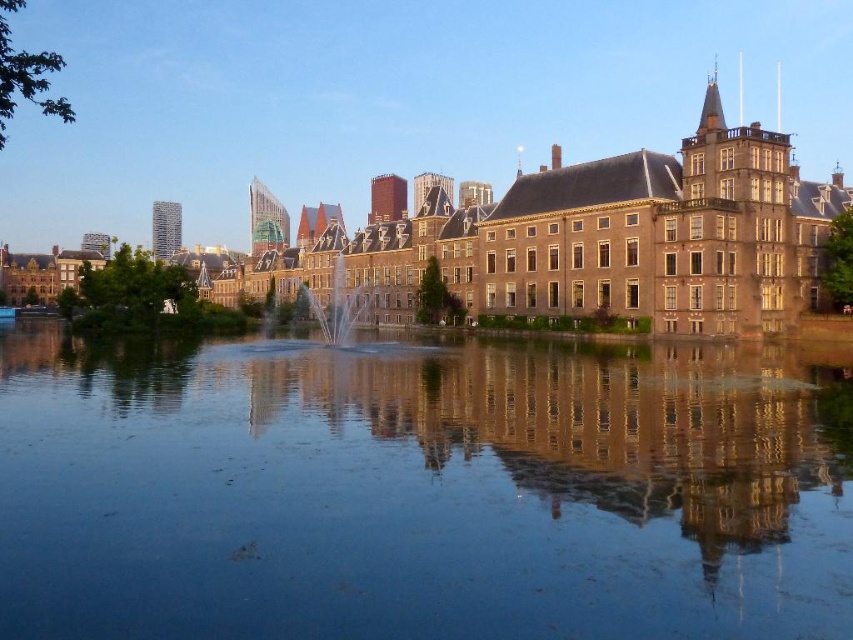
Measure the distance between brown stone building at center and clear glass fountain at center.

brown stone building at center and clear glass fountain at center are 18.50 meters apart from each other.

Which is behind, point (422, 243) or point (344, 332)?

Point (422, 243)

Does point (595, 260) come farther from viewer compared to point (310, 300)?

That is False.

Locate an element on the screen. brown stone building at center is located at coordinates (583, 241).

Does smooth reflective water at center appear over brown stone building at center?

Actually, smooth reflective water at center is below brown stone building at center.

Which is in front, point (654, 467) or point (631, 252)?

Point (654, 467) is more forward.

Who is more distant from viewer, (691, 433) or (583, 221)?

The point (583, 221) is more distant.

The height and width of the screenshot is (640, 853). Identify the location of smooth reflective water at center. (416, 493).

Is smooth reflective water at center below clear glass fountain at center?

Indeed, smooth reflective water at center is positioned under clear glass fountain at center.

Locate an element on the screen. This screenshot has width=853, height=640. smooth reflective water at center is located at coordinates (416, 493).

This screenshot has height=640, width=853. Find the location of `smooth reflective water at center`. smooth reflective water at center is located at coordinates (416, 493).